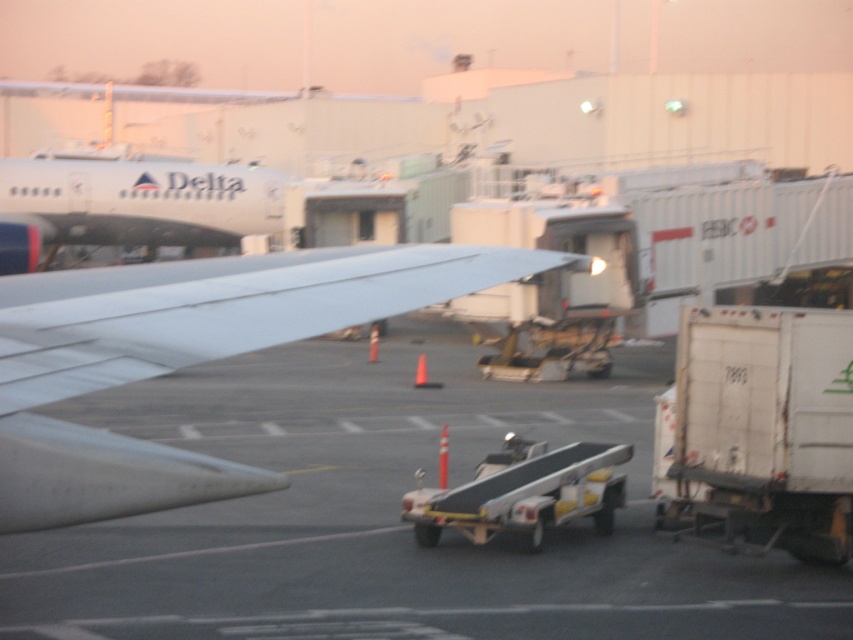
Question: Which point is closer to the camera?

Choices:
 (A) (747, 435)
 (B) (65, 330)
 (C) (432, 534)
 (D) (239, 216)

Answer: (B)

Question: Is white matte truck at right wider than metallic gray conveyor belt at center?

Choices:
 (A) yes
 (B) no

Answer: (B)

Question: Can you confirm if white matte truck at right is smaller than matte white airplane at upper left?

Choices:
 (A) yes
 (B) no

Answer: (A)

Question: Which point is closer to the camera taking this photo?

Choices:
 (A) (160, 499)
 (B) (767, 524)
 (C) (61, 211)
 (D) (633, 557)

Answer: (A)

Question: Which point appears farthest from the camera in this image?

Choices:
 (A) (426, 522)
 (B) (59, 508)
 (C) (86, 212)
 (D) (27, 532)

Answer: (C)

Question: Is white matte truck at right thinner than matte white airplane at upper left?

Choices:
 (A) yes
 (B) no

Answer: (A)